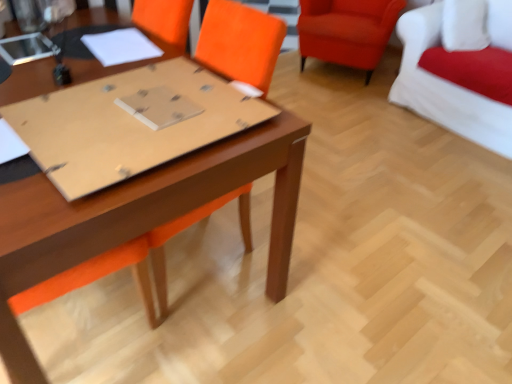
Question: Considering the positions of matte cardboard at center and matte brown table at center in the image, is matte cardboard at center wider or thinner than matte brown table at center?

Choices:
 (A) thin
 (B) wide

Answer: (A)

Question: Does point (155, 135) appear closer or farther from the camera than point (265, 132)?

Choices:
 (A) closer
 (B) farther

Answer: (A)

Question: Which object is positioned farthest from the matte brown table at center?

Choices:
 (A) velvet orange armchair at upper right, positioned as the 2th chair in right-to-left order
 (B) white paper at center
 (C) matte cardboard at center
 (D) white fabric couch at upper right, placed as the first chair when sorted from right to left

Answer: (A)

Question: Which object is positioned closest to the white fabric couch at upper right, marked as the second chair in a left-to-right arrangement?

Choices:
 (A) white paper at center
 (B) matte cardboard at center
 (C) velvet orange armchair at upper right, positioned as the 2th chair in right-to-left order
 (D) matte brown table at center

Answer: (C)